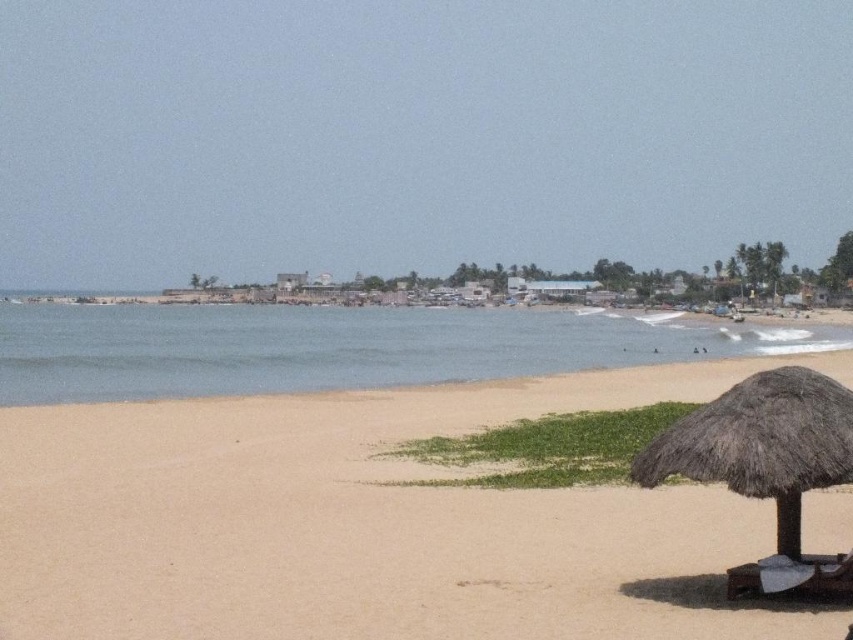
Question: Is light brown sand at lower left further to the viewer compared to white fabric beach chair at lower right?

Choices:
 (A) yes
 (B) no

Answer: (B)

Question: Which of the following is the farthest from the observer?

Choices:
 (A) thatched straw umbrella at lower right
 (B) blue water at center
 (C) light brown sand at lower left

Answer: (B)

Question: Can you confirm if light brown sand at lower left is smaller than thatched straw umbrella at lower right?

Choices:
 (A) yes
 (B) no

Answer: (B)

Question: Can you confirm if blue water at center is positioned above white fabric beach chair at lower right?

Choices:
 (A) no
 (B) yes

Answer: (B)

Question: Among these points, which one is nearest to the camera?

Choices:
 (A) (115, 460)
 (B) (282, 314)
 (C) (735, 445)

Answer: (C)

Question: Which point is closer to the camera?

Choices:
 (A) (117, 419)
 (B) (825, 465)
 (C) (790, 561)
 (D) (788, 339)

Answer: (B)